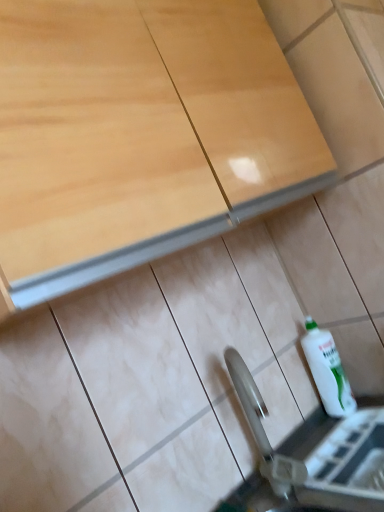
Measure the distance between white glossy bottle at lower right and camera.

A distance of 1.12 meters exists between white glossy bottle at lower right and camera.

Where is `white glossy bottle at lower right`? Image resolution: width=384 pixels, height=512 pixels. white glossy bottle at lower right is located at coordinates (327, 370).

Measure the distance between point (337, 431) and camera.

3.55 feet.

At what (x,y) coordinates should I click in order to perform the action: click on white glossy bottle at lower right. Please return your answer as a coordinate pair (x, y). Looking at the image, I should click on (327, 370).

Which of these two, matte wood cabinet at upper center or white glossy bottle at lower right, is smaller?

white glossy bottle at lower right is smaller.

Is matte wood cabinet at upper center outside of white glossy bottle at lower right?

Yes.

Considering the relative positions of matte wood cabinet at upper center and white glossy bottle at lower right in the image provided, is matte wood cabinet at upper center behind white glossy bottle at lower right?

No, matte wood cabinet at upper center is closer to the viewer.

Is matte wood cabinet at upper center taller than white glossy bottle at lower right?

Yes.

Between metallic silver sink at lower center and white glossy bottle at lower right, which one appears on the right side from the viewer's perspective?

metallic silver sink at lower center.

Looking at this image, can you confirm if metallic silver sink at lower center is bigger than white glossy bottle at lower right?

Correct, metallic silver sink at lower center is larger in size than white glossy bottle at lower right.

Where is `sink on the right side of white glossy bottle at lower right`? The width and height of the screenshot is (384, 512). sink on the right side of white glossy bottle at lower right is located at coordinates (312, 456).

Is metallic silver sink at lower center further to the viewer compared to white glossy bottle at lower right?

No, metallic silver sink at lower center is in front of white glossy bottle at lower right.

Considering their positions, is matte wood cabinet at upper center located in front of or behind metallic silver sink at lower center?

matte wood cabinet at upper center is positioned closer to the viewer than metallic silver sink at lower center.

Is matte wood cabinet at upper center aimed at metallic silver sink at lower center?

No.

Would you say matte wood cabinet at upper center contains metallic silver sink at lower center?

That's incorrect, metallic silver sink at lower center is not inside matte wood cabinet at upper center.

Where is `cabinetry above the white glossy bottle at lower right (from a real-world perspective)`? cabinetry above the white glossy bottle at lower right (from a real-world perspective) is located at coordinates (140, 135).

Considering the sizes of white glossy bottle at lower right and matte wood cabinet at upper center in the image, is white glossy bottle at lower right bigger or smaller than matte wood cabinet at upper center?

Clearly, white glossy bottle at lower right is smaller in size than matte wood cabinet at upper center.

How many degrees apart are the facing directions of white glossy bottle at lower right and matte wood cabinet at upper center?

The facing directions of white glossy bottle at lower right and matte wood cabinet at upper center are 3.17 degrees apart.

Does white glossy bottle at lower right appear on the right side of matte wood cabinet at upper center?

Yes, white glossy bottle at lower right is to the right of matte wood cabinet at upper center.

Which object is thinner, white glossy bottle at lower right or metallic silver sink at lower center?

white glossy bottle at lower right is thinner.

From the image's perspective, is white glossy bottle at lower right over metallic silver sink at lower center?

Indeed, from the image's perspective, white glossy bottle at lower right is shown above metallic silver sink at lower center.

Considering the sizes of white glossy bottle at lower right and metallic silver sink at lower center in the image, is white glossy bottle at lower right taller or shorter than metallic silver sink at lower center?

Considering their sizes, white glossy bottle at lower right has more height than metallic silver sink at lower center.

From a real-world perspective, is metallic silver sink at lower center located higher than matte wood cabinet at upper center?

No.

Is metallic silver sink at lower center taller than matte wood cabinet at upper center?

In fact, metallic silver sink at lower center may be shorter than matte wood cabinet at upper center.

Where is `sink below the matte wood cabinet at upper center (from the image's perspective)`? sink below the matte wood cabinet at upper center (from the image's perspective) is located at coordinates (312, 456).

From the image's perspective, is metallic silver sink at lower center positioned above or below matte wood cabinet at upper center?

From the image's perspective, metallic silver sink at lower center appears below matte wood cabinet at upper center.

Where is `bottle beneath the matte wood cabinet at upper center (from a real-world perspective)`? Image resolution: width=384 pixels, height=512 pixels. bottle beneath the matte wood cabinet at upper center (from a real-world perspective) is located at coordinates (327, 370).

Where is `sink below the white glossy bottle at lower right (from the image's perspective)`? sink below the white glossy bottle at lower right (from the image's perspective) is located at coordinates (312, 456).

Estimate the real-world distances between objects in this image. Which object is further from metallic silver sink at lower center, white glossy bottle at lower right or matte wood cabinet at upper center?

Among the two, matte wood cabinet at upper center is located further to metallic silver sink at lower center.

Based on their spatial positions, is matte wood cabinet at upper center or metallic silver sink at lower center closer to white glossy bottle at lower right?

Among the two, metallic silver sink at lower center is located nearer to white glossy bottle at lower right.

Which object lies further to the anchor point metallic silver sink at lower center, matte wood cabinet at upper center or white glossy bottle at lower right?

Among the two, matte wood cabinet at upper center is located further to metallic silver sink at lower center.

From the image, which object appears to be nearer to white glossy bottle at lower right, metallic silver sink at lower center or matte wood cabinet at upper center?

Based on the image, metallic silver sink at lower center appears to be nearer to white glossy bottle at lower right.

Which object lies nearer to the anchor point matte wood cabinet at upper center, metallic silver sink at lower center or white glossy bottle at lower right?

Among the two, metallic silver sink at lower center is located nearer to matte wood cabinet at upper center.

When comparing their distances from matte wood cabinet at upper center, does white glossy bottle at lower right or metallic silver sink at lower center seem closer?

Based on the image, metallic silver sink at lower center appears to be nearer to matte wood cabinet at upper center.

Locate an element on the screen. bottle between matte wood cabinet at upper center and metallic silver sink at lower center in the vertical direction is located at coordinates (327, 370).